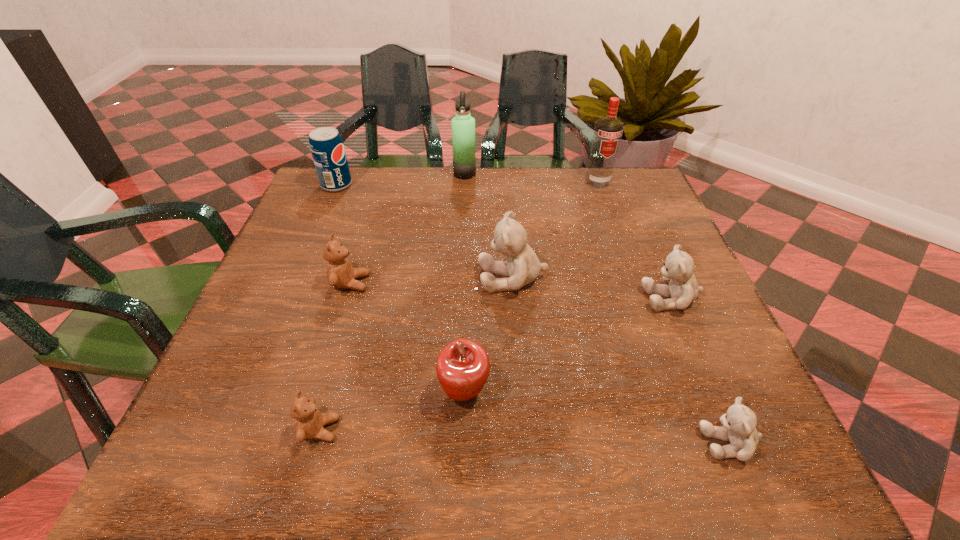
At what (x,y) coordinates should I click in order to perform the action: click on vacant region located 0.130m on the face of the second biggest gray teddy bear. Please return your answer as a coordinate pair (x, y). The image size is (960, 540). Looking at the image, I should click on (580, 299).

The image size is (960, 540). In order to click on free space located on the right of the apple in this screenshot , I will do click(x=652, y=392).

In order to click on free point located 0.080m on the face of the smaller brown teddy bear in this screenshot , I will do `click(388, 429)`.

This screenshot has width=960, height=540. What are the coordinates of `vacant space located on the face of the nearest gray teddy bear` in the screenshot? It's located at (636, 442).

Locate an element on the screen. The height and width of the screenshot is (540, 960). vacant area located on the face of the nearest gray teddy bear is located at coordinates (656, 442).

Locate an element on the screen. This screenshot has height=540, width=960. free point located on the face of the nearest gray teddy bear is located at coordinates (491, 442).

Where is `thermos bottle positioned at the far edge`? This screenshot has height=540, width=960. thermos bottle positioned at the far edge is located at coordinates (463, 125).

What are the coordinates of `vodka at the far edge` in the screenshot? It's located at (608, 131).

The width and height of the screenshot is (960, 540). I want to click on pop that is at the far edge, so click(327, 148).

You are a GUI agent. You are given a task and a screenshot of the screen. Output one action in this format:
    pyautogui.click(x=<x>, y=<y>)
    Task: Click on the pop at the left edge
    
    Given the screenshot: What is the action you would take?
    pyautogui.click(x=327, y=148)